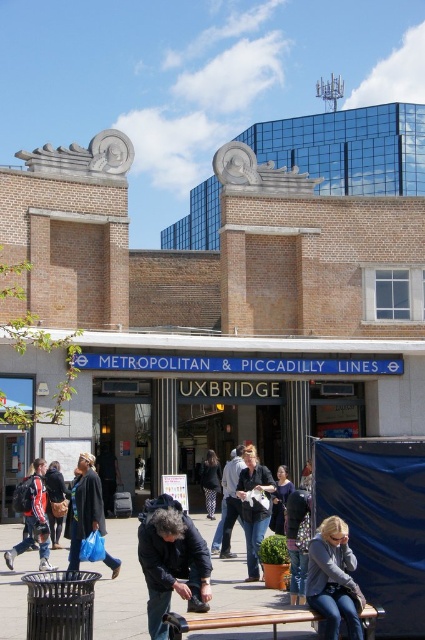
You are a fashion designer observing the crowd at the station entrance. You notice a person wearing a dark blue jacket at lower center and dark blue jeans at center. Which clothing item is wider?

The dark blue jacket at lower center is wider than the dark blue jeans at center as its width surpasses the jeans.

You are a traveler who needs to sit down. You see a smooth concrete bench at lower center and a matte black jacket at lower left. Which one can you sit on?

The smooth concrete bench at lower center is bigger than the matte black jacket at lower left, so you can sit on the smooth concrete bench at lower center.